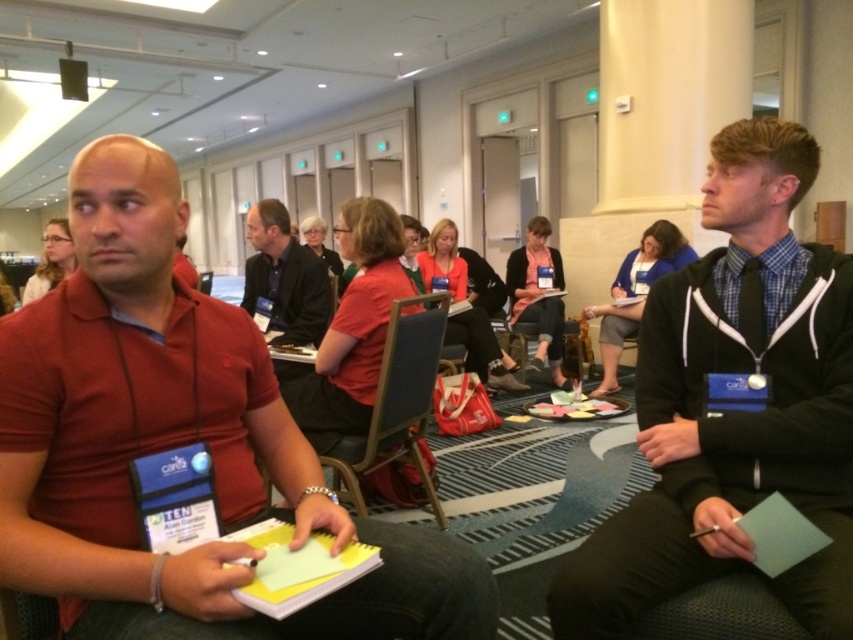
From the picture: Is blue fabric jacket at center below matte black chair at center?

Yes.

Which is behind, point (637, 278) or point (209, 275)?

The point (637, 278) is more distant.

Which is behind, point (656, 275) or point (210, 289)?

Point (656, 275)

The image size is (853, 640). I want to click on blue fabric jacket at center, so click(x=635, y=292).

Can you confirm if blue fabric chair at center is bigger than matte black shirt at left?

No.

The width and height of the screenshot is (853, 640). What do you see at coordinates (397, 404) in the screenshot?
I see `blue fabric chair at center` at bounding box center [397, 404].

Identify the location of blue fabric chair at center. (397, 404).

Is matte black shirt at left positioned behind matte black chair at center?

No, it is not.

From the picture: Is matte black shirt at left bigger than matte black chair at center?

Yes.

Describe the element at coordinates (51, 260) in the screenshot. I see `matte black shirt at left` at that location.

I want to click on matte black shirt at left, so click(x=51, y=260).